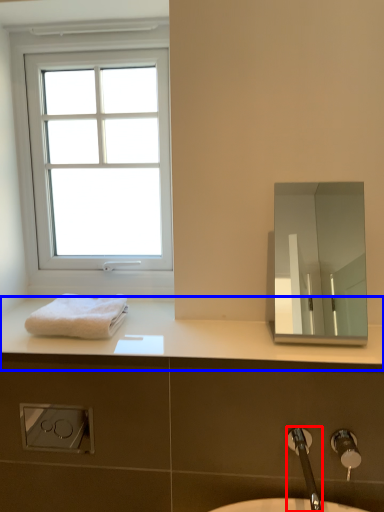
Question: Which point is closer to the camera, tap (highlighted by a red box) or counter top (highlighted by a blue box)?

Choices:
 (A) tap
 (B) counter top

Answer: (A)